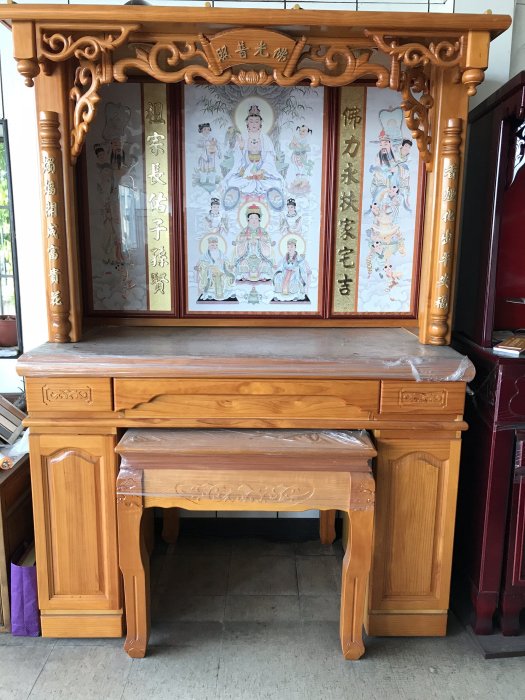
Where is `window`? window is located at coordinates click(x=9, y=292).